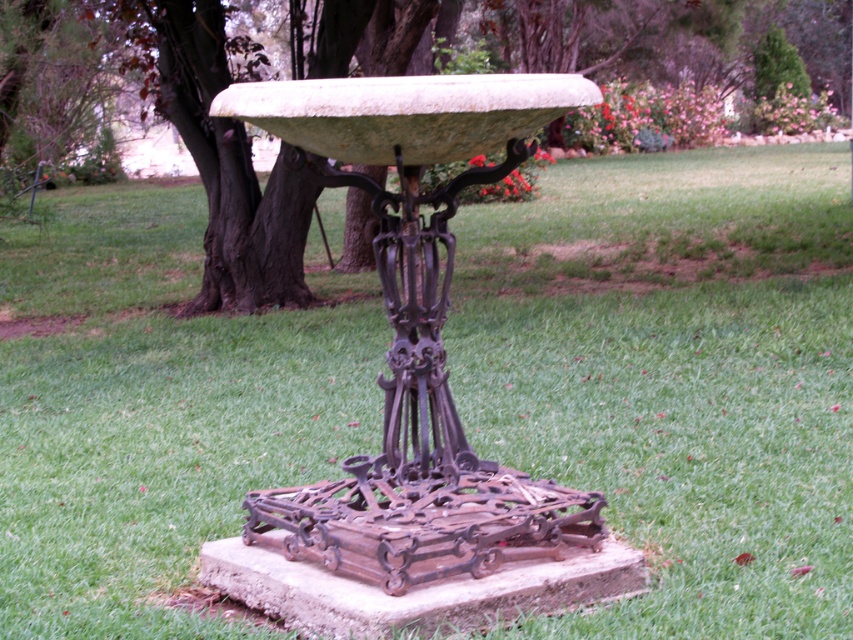
Does green stone bowl at center have a greater height compared to green matte stone bowl at center?

Incorrect, green stone bowl at center's height is not larger of green matte stone bowl at center's.

Is green stone bowl at center wider than green matte stone bowl at center?

Incorrect, green stone bowl at center's width does not surpass green matte stone bowl at center's.

I want to click on green stone bowl at center, so click(x=416, y=332).